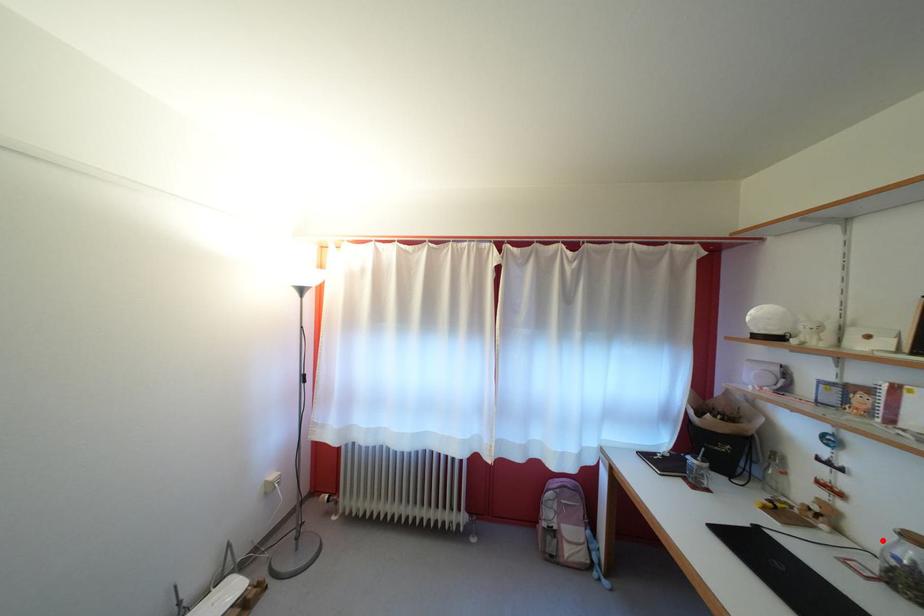
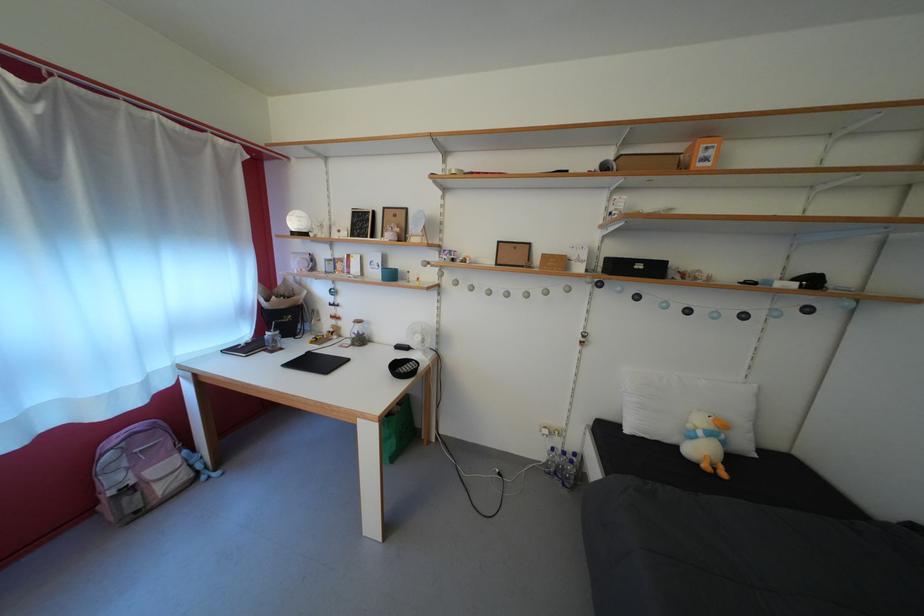
The point at the highlighted location is marked in the first image. Where is the corresponding point in the second image?

(358, 334)